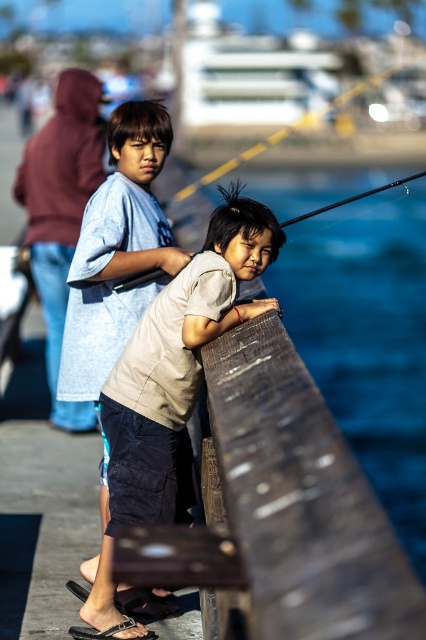
Does beige cotton shirt at center come in front of light blue cotton shirt at center?

That is True.

Consider the image. Can you confirm if beige cotton shirt at center is positioned to the left of light blue cotton shirt at center?

In fact, beige cotton shirt at center is to the right of light blue cotton shirt at center.

Who is more distant from viewer, (169, 296) or (109, 237)?

Positioned behind is point (109, 237).

Find the location of a particular element. This screenshot has width=426, height=640. beige cotton shirt at center is located at coordinates (172, 387).

Where is `matte black fishing pole at upper center`? The image size is (426, 640). matte black fishing pole at upper center is located at coordinates (351, 198).

Is matte black fishing pole at upper center positioned in front of black glossy fishing pole at upper right?

Yes.

Identify the location of matte black fishing pole at upper center. This screenshot has width=426, height=640. (351, 198).

Who is higher up, light blue cotton shirt at center or black glossy fishing pole at upper right?

black glossy fishing pole at upper right is above.

Looking at this image, does light blue cotton shirt at center appear on the left side of black glossy fishing pole at upper right?

Indeed, light blue cotton shirt at center is positioned on the left side of black glossy fishing pole at upper right.

Who is more distant from viewer, [147,166] or [385,186]?

Positioned behind is point [385,186].

Identify the location of light blue cotton shirt at center. This screenshot has width=426, height=640. (117, 250).